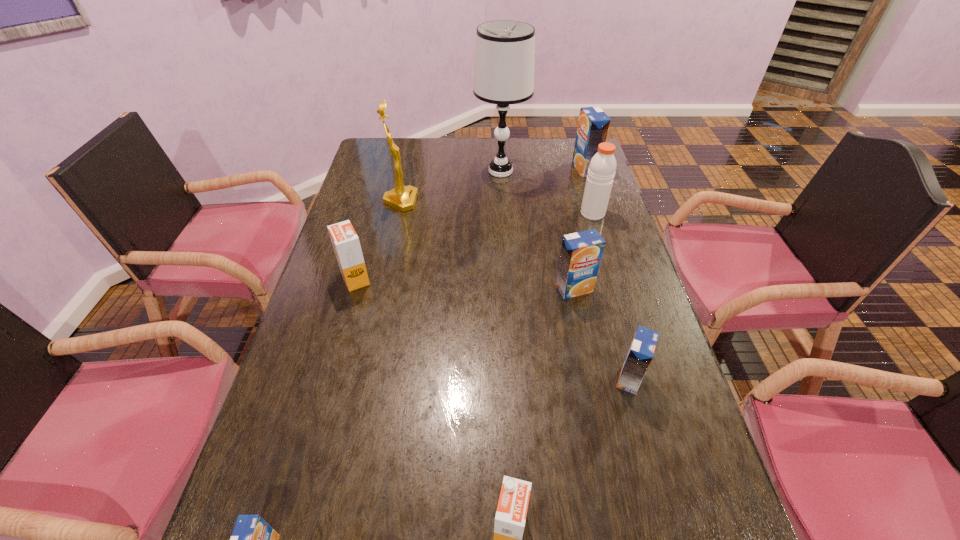
This screenshot has height=540, width=960. What are the coordinates of `orange_juice that is at the far edge` in the screenshot? It's located at (593, 125).

At what (x,y) coordinates should I click in order to perform the action: click on award that is at the left edge. Please return your answer as a coordinate pair (x, y). Looking at the image, I should click on (403, 198).

Identify the location of orange juice located in the left edge section of the desktop. The image size is (960, 540). (346, 244).

Identify the location of shaker located at the right edge. click(x=601, y=172).

This screenshot has height=540, width=960. What are the coordinates of `object that is at the far right corner` in the screenshot? It's located at point(593,125).

Where is `free space at the far edge`? free space at the far edge is located at coordinates (414, 157).

Where is `vacant space at the left edge of the desktop`? The image size is (960, 540). vacant space at the left edge of the desktop is located at coordinates (366, 220).

Where is `vacant space at the right edge of the desktop`? This screenshot has width=960, height=540. vacant space at the right edge of the desktop is located at coordinates (654, 370).

The image size is (960, 540). What are the coordinates of `vacant space at the far left corner of the desktop` in the screenshot? It's located at [376, 142].

The width and height of the screenshot is (960, 540). What are the coordinates of `free spot between the tallest object and the orange shaker` in the screenshot? It's located at (546, 192).